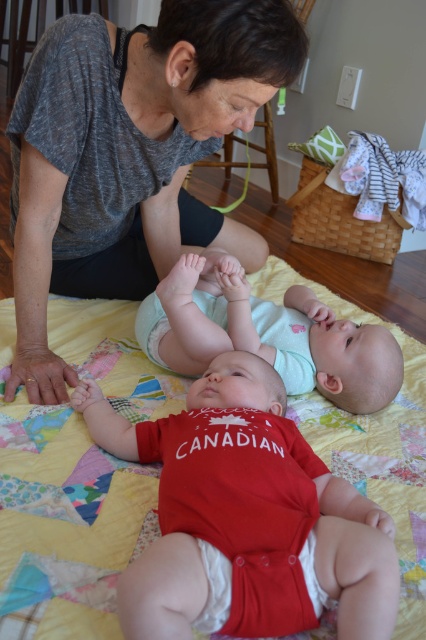
Can you confirm if matte red onesie at center is taller than white cloth diaper at lower center?

Correct, matte red onesie at center is much taller as white cloth diaper at lower center.

Between matte red onesie at center and white cloth diaper at lower center, which one is positioned lower?

white cloth diaper at lower center is below.

Between point (167, 417) and point (206, 614), which one is positioned behind?

Point (167, 417)

Identify the location of matte red onesie at center. The image size is (426, 640). (244, 512).

Who is lower down, gray textured shirt at upper left or white cloth diaper at lower center?

Positioned lower is white cloth diaper at lower center.

Is point (111, 272) less distant than point (218, 609)?

No, it is not.

Which is behind, point (267, 86) or point (308, 579)?

The point (267, 86) is behind.

Where is `gray textured shirt at upper left`? The height and width of the screenshot is (640, 426). gray textured shirt at upper left is located at coordinates (129, 156).

Which of these two, matte red onesie at center or light blue fabric diaper at center, stands shorter?

light blue fabric diaper at center

Does matte red onesie at center appear under light blue fabric diaper at center?

Correct, matte red onesie at center is located below light blue fabric diaper at center.

Measure the distance between point (362,609) and camera.

Point (362,609) is 75.68 centimeters away from camera.

At what (x,y) coordinates should I click in order to perform the action: click on matte red onesie at center. Please return your answer as a coordinate pair (x, y). This screenshot has width=426, height=640. Looking at the image, I should click on (244, 512).